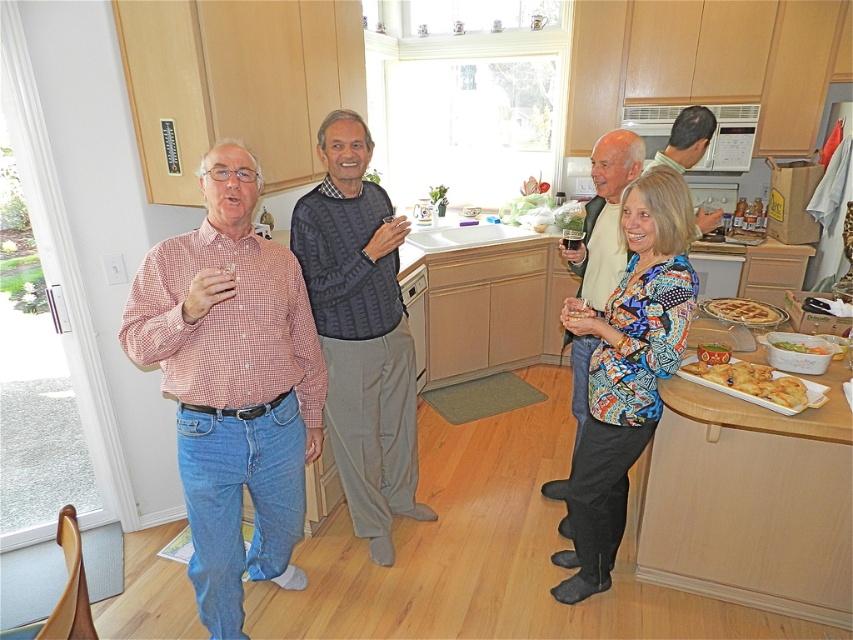
You are a bartender at the event and need to serve a drink to the person wearing the checkered cotton shirt at left and the person holding the clear plastic cup at center. Since you can only carry one drink at a time, which person should you approach first to ensure you don

The checkered cotton shirt at left is positioned on the left side of the clear plastic cup at center, so you should approach the person wearing the checkered cotton shirt at left first to minimize backtracking.

You are a photographer standing in the kitchen and want to take a group photo of the checkered cotton shirt at left and the knitted sweater at center. The camera you are using has a maximum focus range of 18 inches. Will both subjects be in focus?

The checkered cotton shirt at left and knitted sweater at center are 17.30 inches apart, so yes, both subjects will be in focus since the distance between them is within the camera maximum focus range of 18 inches.

Where is the knitted sweater at center located in the image?

The knitted sweater at center is located at point coordinates of (x=361, y=332).